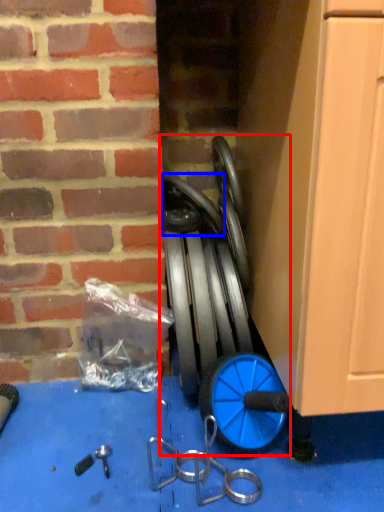
Question: Which of the following is the farthest to the observer, garden hose (highlighted by a red box) or wheel (highlighted by a blue box)?

Choices:
 (A) garden hose
 (B) wheel

Answer: (B)